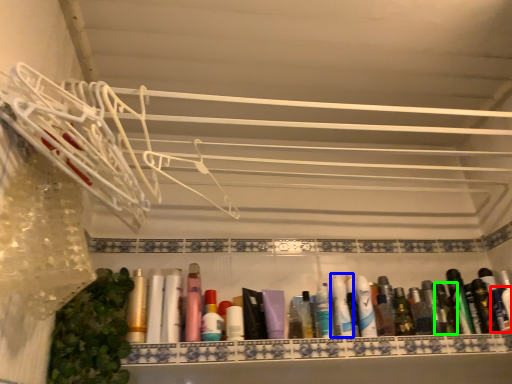
Question: Based on their relative distances, which object is nearer to toiletry (highlighted by a red box)? Choose from toothpaste (highlighted by a blue box) and toiletry (highlighted by a green box).

Choices:
 (A) toothpaste
 (B) toiletry

Answer: (B)